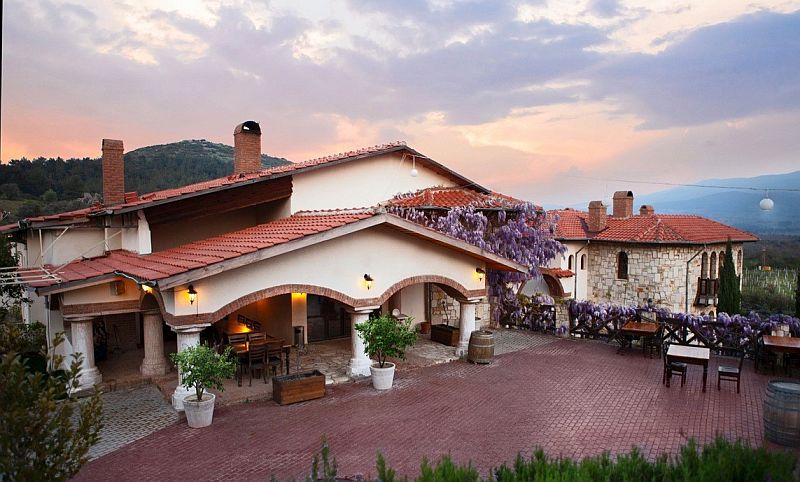
The height and width of the screenshot is (482, 800). I want to click on light sconce, so click(x=190, y=294), click(x=368, y=283), click(x=478, y=271).